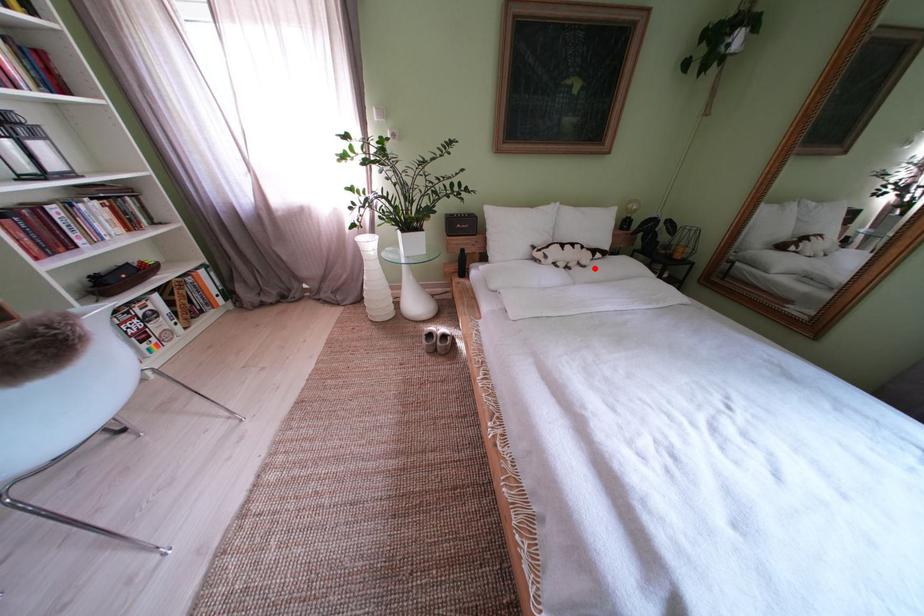
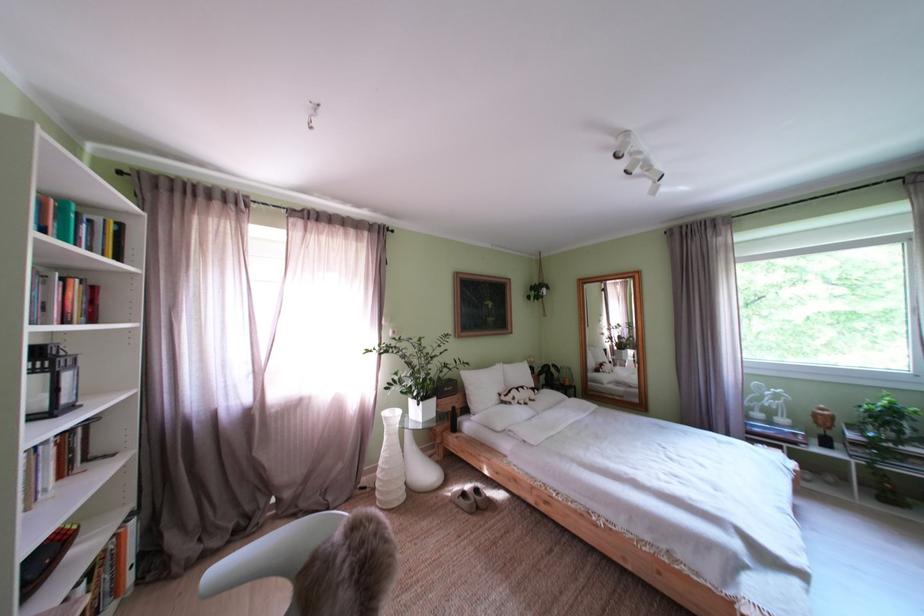
Question: I am providing you with two images of the same scene from different viewpoints. A red point is shown in image1. For the corresponding object point in image2, is it positioned nearer or farther from the camera?

Choices:
 (A) Nearer
 (B) Farther

Answer: (B)